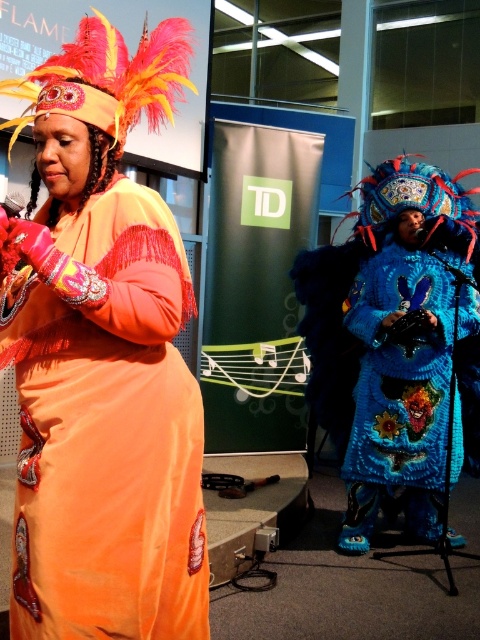
Question: Which of the following is the farthest from the observer?

Choices:
 (A) velvet orange dress at center
 (B) blue knitted robe at center

Answer: (B)

Question: Among these points, which one is farthest from the camera?

Choices:
 (A) (59, 520)
 (B) (420, 474)

Answer: (B)

Question: Which point appears closest to the camera in this image?

Choices:
 (A) (462, 262)
 (B) (108, 493)

Answer: (B)

Question: Does velvet orange dress at center appear on the left side of blue knitted robe at center?

Choices:
 (A) yes
 (B) no

Answer: (A)

Question: Is velvet orange dress at center smaller than blue knitted robe at center?

Choices:
 (A) no
 (B) yes

Answer: (B)

Question: From the image, what is the correct spatial relationship of velvet orange dress at center in relation to blue knitted robe at center?

Choices:
 (A) left
 (B) right

Answer: (A)